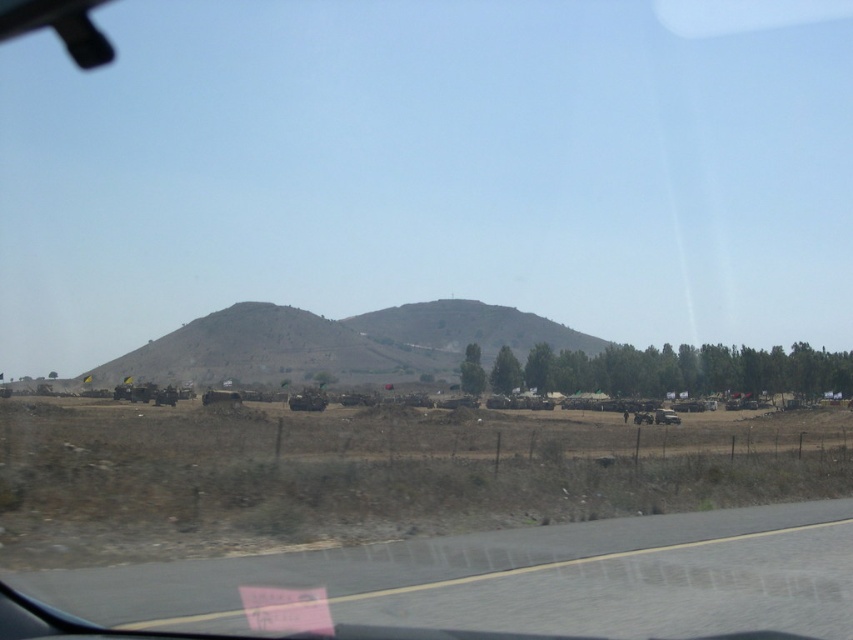
You are a passenger in a car driving on the gray asphalt highway at lower center. You notice the brown textured hill at center in the distance. Which object is closer to you?

The gray asphalt highway at lower center is closer to the viewer than the brown textured hill at center.

You are a passenger in the car and looking through the windshield. There are two points marked on the road ahead. The first point is at coordinates point (451, 577) and the second is at point (525, 340). Which point is closer to the car?

Point (451, 577) is closer to the car than point (525, 340) because it is closer to the camera.